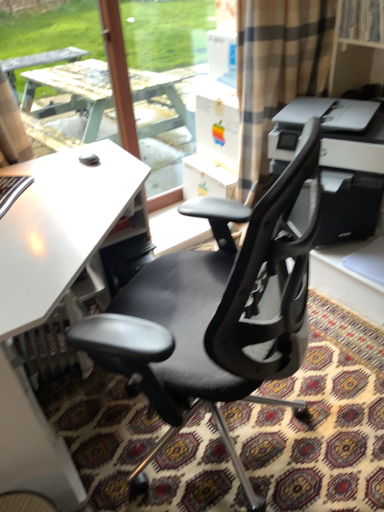
Locate an element on the screen. The width and height of the screenshot is (384, 512). vacant area on top of white matte desk at center (from a real-world perspective) is located at coordinates (65, 204).